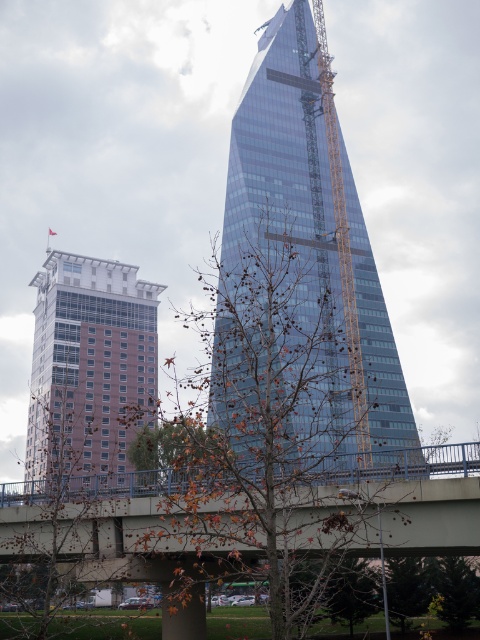
You are a drone operator who needs to fly a drone from the flagpole on the left building to the glassy blue skyscraper at center. According to the coordinates in the scene description, what is the direction you should fly the drone to reach the skyscraper?

The glassy blue skyscraper at center is located at coordinates point [313,257]. Since the flagpole is on the left building, the drone should fly towards the center of the image to reach the skyscraper.

You are a delivery drone flying over an urban area. You need to deliver a package to the brown brick building at left. There is a brown leafy tree at center in your path. Based on their positions, which direction should you adjust your flight path to avoid the tree and reach the building?

The brown leafy tree at center is to the right of the brown brick building at left. To avoid the tree and reach the building, you should adjust your flight path to the left.

You are a delivery person trying to deliver a package to the brown brick building at left. You see the brown leafy tree at center blocking the entrance. Can you walk around the tree to reach the building?

The brown leafy tree at center is in front of the brown brick building at left, so you can walk around the tree to reach the building.